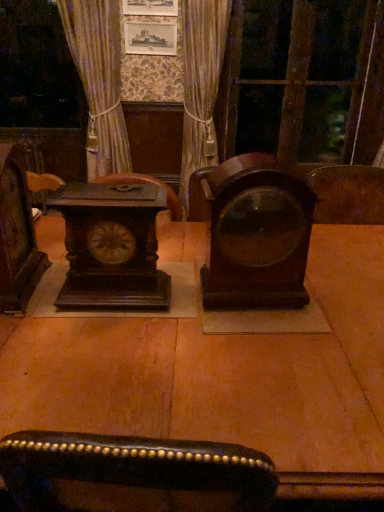
Identify the location of vacant space in front of dark wood clock at left. (33, 331).